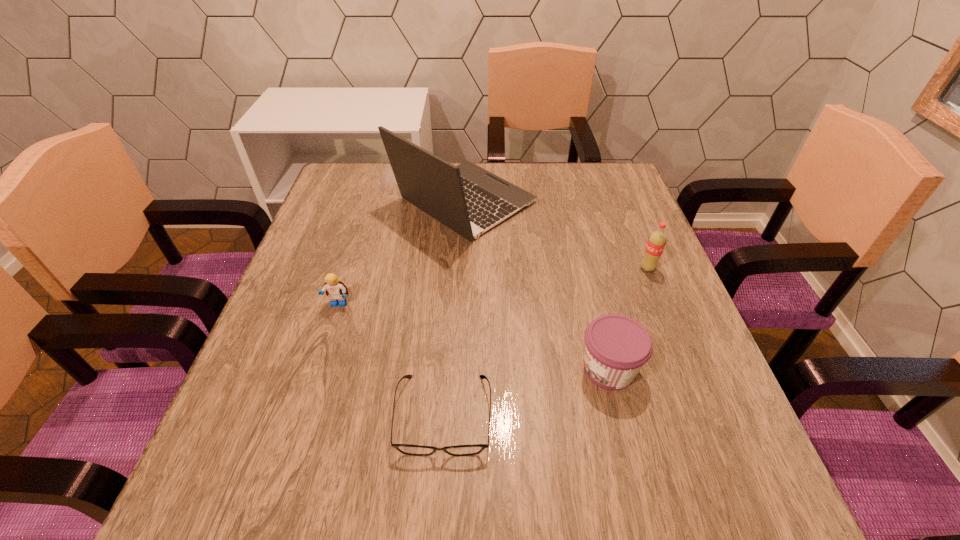
Locate an element on the screen. Image resolution: width=960 pixels, height=540 pixels. free space located on the front label of the second object from right to left is located at coordinates (493, 369).

Locate an element on the screen. blank space located on the front label of the second object from right to left is located at coordinates (398, 369).

What are the coordinates of `vacant space situated 0.200m on the front label of the second object from right to left` in the screenshot? It's located at (472, 369).

Locate an element on the screen. The height and width of the screenshot is (540, 960). free space located on the front-facing side of the third farthest object is located at coordinates (324, 351).

Image resolution: width=960 pixels, height=540 pixels. Identify the location of free space located 0.070m on the front-facing side of the spectacles. (438, 506).

I want to click on object present at the far edge, so click(468, 199).

The width and height of the screenshot is (960, 540). I want to click on object situated at the left edge, so click(336, 290).

Find the location of a particular element. This screenshot has width=960, height=540. soda at the right edge is located at coordinates (657, 240).

Where is `jam present at the right edge`? This screenshot has width=960, height=540. jam present at the right edge is located at coordinates (616, 347).

You are a GUI agent. You are given a task and a screenshot of the screen. Output one action in this format:
    pyautogui.click(x=<x>, y=<y>)
    Task: Click on the free space at the far edge of the desktop
    This screenshot has height=540, width=960.
    Given the screenshot: What is the action you would take?
    pyautogui.click(x=386, y=198)